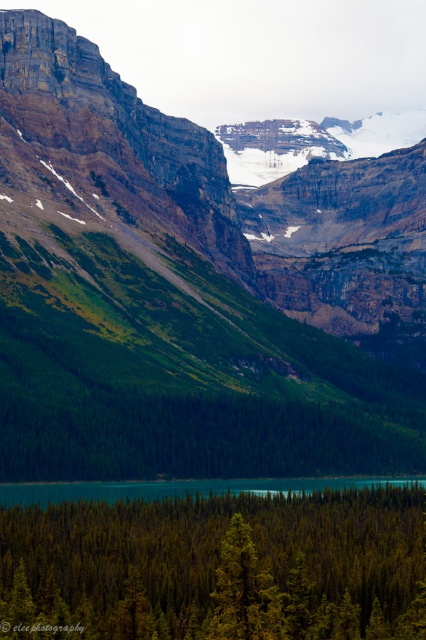
Which is behind, point (117, 120) or point (5, 486)?

The point (117, 120) is behind.

The image size is (426, 640). What are the coordinates of `green mossy rock at center` in the screenshot? It's located at (169, 298).

Is green mossy rock at center thinner than green matte tree at center?

No, green mossy rock at center is not thinner than green matte tree at center.

Between green mossy rock at center and green matte tree at center, which one has more height?

green mossy rock at center

Which is in front, point (135, 428) or point (39, 538)?

Point (39, 538) is in front.

Identify the location of green mossy rock at center. (169, 298).

How much distance is there between green matte tree at center and teal glossy water at center?

green matte tree at center is 51.15 meters from teal glossy water at center.

Who is shorter, green matte tree at center or teal glossy water at center?

Standing shorter between the two is teal glossy water at center.

You are a GUI agent. You are given a task and a screenshot of the screen. Output one action in this format:
    pyautogui.click(x=<x>, y=<y>)
    Task: Click on the green matte tree at center
    This screenshot has width=426, height=640.
    Given the screenshot: What is the action you would take?
    pyautogui.click(x=216, y=566)